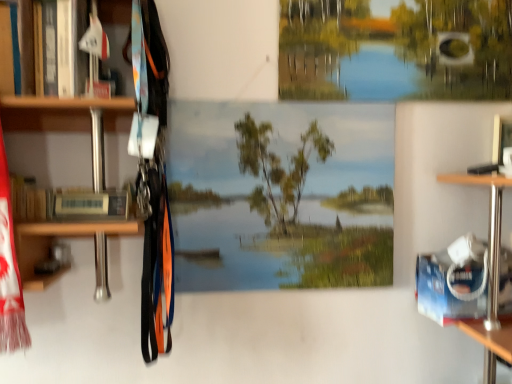
Question: Considering the positions of green matte tree at upper center and smooth canvas mural at center in the image, is green matte tree at upper center wider or thinner than smooth canvas mural at center?

Choices:
 (A) wide
 (B) thin

Answer: (A)

Question: Considering the positions of green matte tree at upper center and smooth canvas mural at center in the image, is green matte tree at upper center bigger or smaller than smooth canvas mural at center?

Choices:
 (A) small
 (B) big

Answer: (A)

Question: Which object is positioned closest to the green matte tree at upper center?

Choices:
 (A) hardcover book at left
 (B) smooth canvas mural at center

Answer: (B)

Question: Which of these objects is positioned closest to the smooth canvas mural at center?

Choices:
 (A) green matte tree at upper center
 (B) hardcover book at left

Answer: (A)